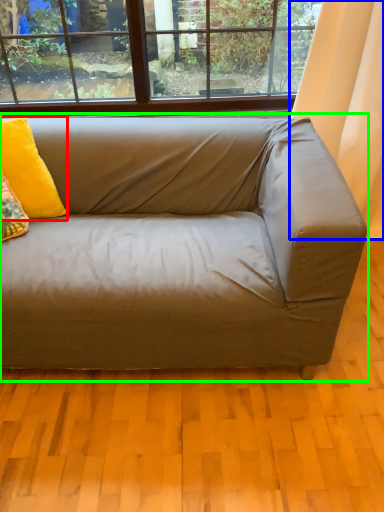
Question: Which object is the closest to the pillow (highlighted by a red box)? Choose among these: curtain (highlighted by a blue box) or studio couch (highlighted by a green box).

Choices:
 (A) curtain
 (B) studio couch

Answer: (B)